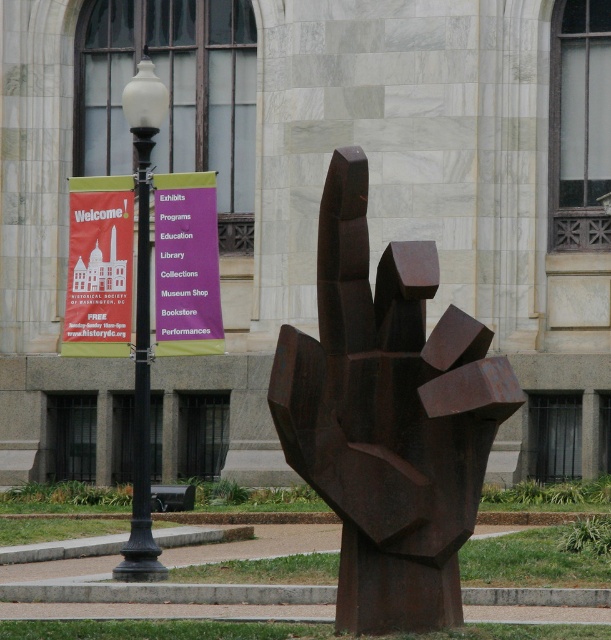
Question: Estimate the real-world distances between objects in this image. Which object is farther from the rusty metal hand at center?

Choices:
 (A) purple matte sign at upper center
 (B) black polished lamp post at upper left
 (C) matte red banner at left

Answer: (C)

Question: Is matte red banner at left further to the viewer compared to purple matte sign at upper center?

Choices:
 (A) yes
 (B) no

Answer: (A)

Question: Can you confirm if rusty metal hand at center is thinner than purple matte sign at upper center?

Choices:
 (A) yes
 (B) no

Answer: (B)

Question: Is purple matte sign at upper center closer to camera compared to black polished lamp post at upper left?

Choices:
 (A) no
 (B) yes

Answer: (A)

Question: Which object is farther from the camera taking this photo?

Choices:
 (A) purple matte sign at upper center
 (B) rusty metal hand at center
 (C) black polished lamp post at upper left
 (D) matte red banner at left

Answer: (D)

Question: Which object appears farthest from the camera in this image?

Choices:
 (A) matte red banner at left
 (B) black polished lamp post at upper left

Answer: (A)